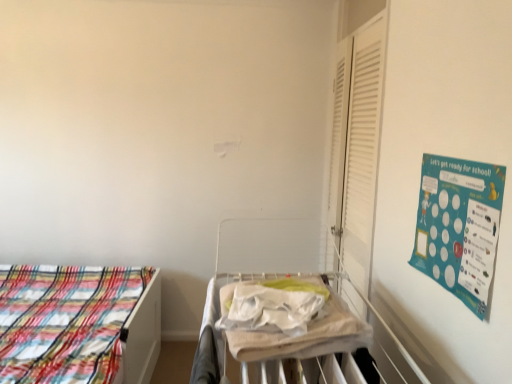
Question: Considering the relative sizes of plaid fabric bed at left and white fabric hospital bed at center in the image provided, is plaid fabric bed at left shorter than white fabric hospital bed at center?

Choices:
 (A) yes
 (B) no

Answer: (A)

Question: From a real-world perspective, is plaid fabric bed at left below white fabric hospital bed at center?

Choices:
 (A) yes
 (B) no

Answer: (A)

Question: Could you tell me if plaid fabric bed at left is facing white fabric hospital bed at center?

Choices:
 (A) yes
 (B) no

Answer: (B)

Question: Is plaid fabric bed at left outside white fabric hospital bed at center?

Choices:
 (A) no
 (B) yes

Answer: (B)

Question: Can you confirm if plaid fabric bed at left is wider than white fabric hospital bed at center?

Choices:
 (A) yes
 (B) no

Answer: (A)

Question: From the image's perspective, is plaid fabric bed at left located beneath white fabric hospital bed at center?

Choices:
 (A) no
 (B) yes

Answer: (B)

Question: Considering the relative sizes of white fabric hospital bed at center and plaid fabric bed at left in the image provided, is white fabric hospital bed at center thinner than plaid fabric bed at left?

Choices:
 (A) yes
 (B) no

Answer: (A)

Question: Is the depth of white fabric hospital bed at center less than that of plaid fabric bed at left?

Choices:
 (A) no
 (B) yes

Answer: (B)

Question: Is there a large distance between white fabric hospital bed at center and plaid fabric bed at left?

Choices:
 (A) no
 (B) yes

Answer: (A)

Question: Considering the relative sizes of white fabric hospital bed at center and plaid fabric bed at left in the image provided, is white fabric hospital bed at center smaller than plaid fabric bed at left?

Choices:
 (A) no
 (B) yes

Answer: (B)

Question: From the image's perspective, is white fabric hospital bed at center on top of plaid fabric bed at left?

Choices:
 (A) no
 (B) yes

Answer: (B)

Question: Is white fabric hospital bed at center next to plaid fabric bed at left?

Choices:
 (A) no
 (B) yes

Answer: (A)

Question: Can you confirm if beige cotton blanket at center is positioned to the left of white matte shutter at right?

Choices:
 (A) no
 (B) yes

Answer: (B)